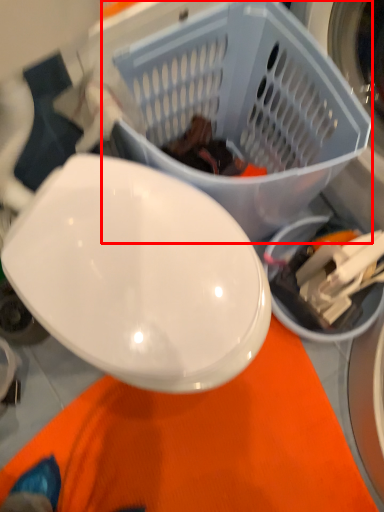
Question: From the image's perspective, where is basket (annotated by the red box) located relative to food?

Choices:
 (A) below
 (B) above

Answer: (A)